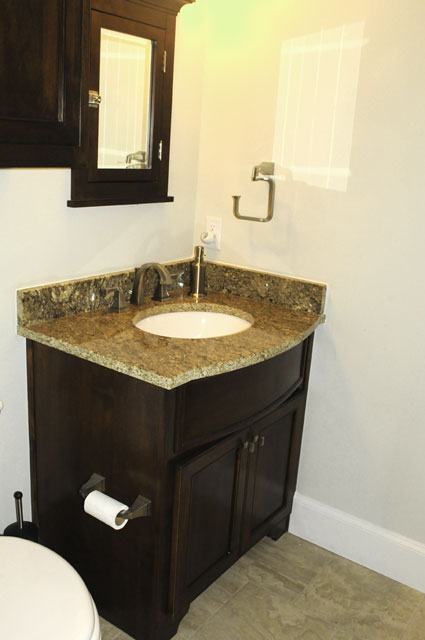
Locate an element on the screen. The height and width of the screenshot is (640, 425). bathroom drawers is located at coordinates (251, 404), (213, 522), (256, 480).